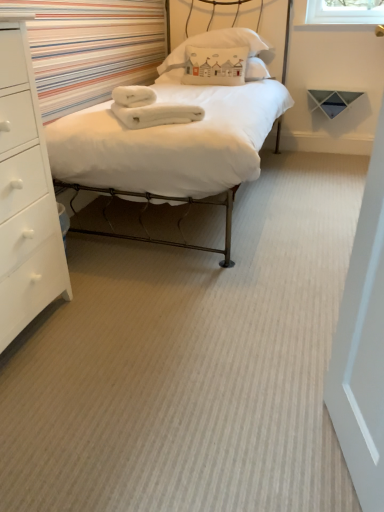
Question: Is white fluffy towels at center to the right of white soft bed at center from the viewer's perspective?

Choices:
 (A) no
 (B) yes

Answer: (A)

Question: Can we say white fluffy towels at center lies outside white soft bed at center?

Choices:
 (A) no
 (B) yes

Answer: (A)

Question: Could you tell me if white fluffy towels at center is facing white soft bed at center?

Choices:
 (A) yes
 (B) no

Answer: (A)

Question: From a real-world perspective, does white fluffy towels at center sit lower than white soft bed at center?

Choices:
 (A) yes
 (B) no

Answer: (B)

Question: Does white fluffy towels at center have a greater height compared to white soft bed at center?

Choices:
 (A) no
 (B) yes

Answer: (A)

Question: From the image's perspective, is white fluffy towels at center below white soft bed at center?

Choices:
 (A) yes
 (B) no

Answer: (A)

Question: Considering the relative sizes of white cotton pillow at upper center and white matte chest of drawers at left in the image provided, is white cotton pillow at upper center smaller than white matte chest of drawers at left?

Choices:
 (A) no
 (B) yes

Answer: (B)

Question: Is white cotton pillow at upper center shorter than white matte chest of drawers at left?

Choices:
 (A) no
 (B) yes

Answer: (B)

Question: From the image's perspective, is white cotton pillow at upper center above white matte chest of drawers at left?

Choices:
 (A) yes
 (B) no

Answer: (A)

Question: Does white cotton pillow at upper center have a greater width compared to white matte chest of drawers at left?

Choices:
 (A) yes
 (B) no

Answer: (A)

Question: Is white cotton pillow at upper center far from white matte chest of drawers at left?

Choices:
 (A) no
 (B) yes

Answer: (B)

Question: Is white cotton pillow at upper center facing towards white matte chest of drawers at left?

Choices:
 (A) no
 (B) yes

Answer: (B)

Question: Is white cotton pillow at upper center positioned before white fluffy towels at center?

Choices:
 (A) no
 (B) yes

Answer: (A)